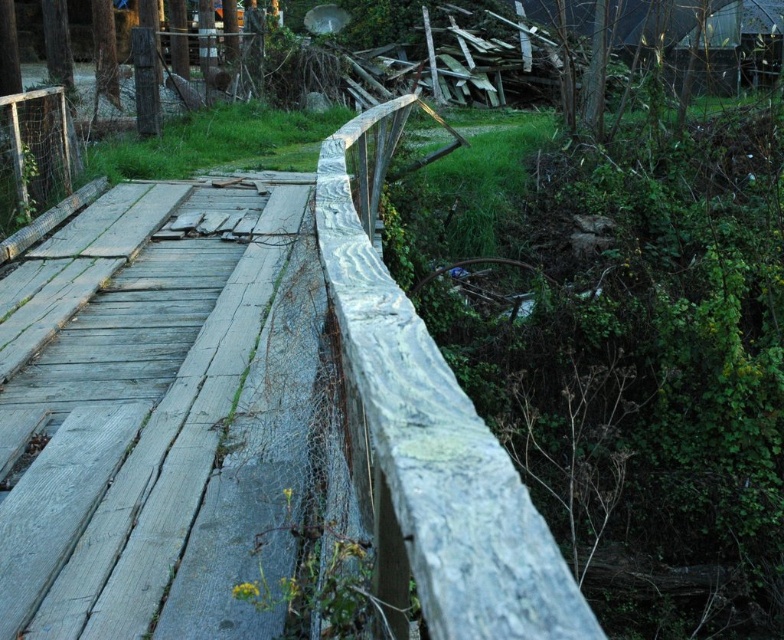
You are a maintenance worker assessing the bridge. You notice the weathered wood planks at center and the weathered wood rail at center. Which object is closer to you when standing on the bridge?

The weathered wood planks at center are closer to you than the weathered wood rail at center.

You are a maintenance worker assessing the bridge. You see the weathered wood planks at center and the weathered wood rail at center. Which one is more to the left?

The weathered wood planks at center is positioned on the left side of weathered wood rail at center, so it is more to the left.